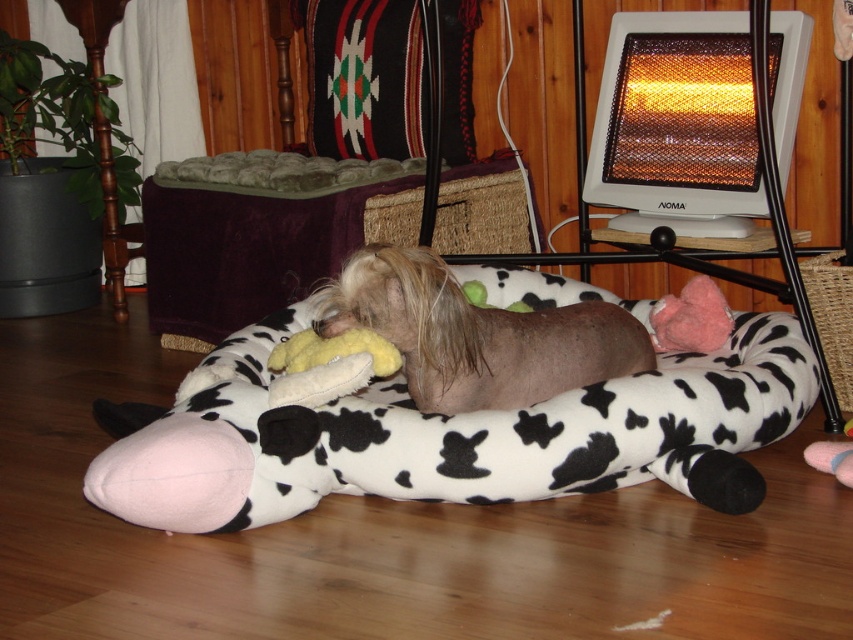
Is cow print plush bed at center taller than brown fuzzy dog at center?

Yes.

Can you confirm if cow print plush bed at center is bigger than brown fuzzy dog at center?

Correct, cow print plush bed at center is larger in size than brown fuzzy dog at center.

Is point (181, 257) less distant than point (474, 340)?

No, it is not.

You are a GUI agent. You are given a task and a screenshot of the screen. Output one action in this format:
    pyautogui.click(x=<x>, y=<y>)
    Task: Click on the cow print plush bed at center
    The height and width of the screenshot is (640, 853).
    Given the screenshot: What is the action you would take?
    pyautogui.click(x=258, y=240)

Is cow print plush bed at center below multicolored woven rug at upper center?

Correct, cow print plush bed at center is located below multicolored woven rug at upper center.

Between point (183, 298) and point (401, 124), which one is positioned behind?

The point (401, 124) is more distant.

I want to click on cow print plush bed at center, so click(x=258, y=240).

Is brown fuzzy dog at center further to the viewer compared to multicolored woven rug at upper center?

No.

Where is `brown fuzzy dog at center`? brown fuzzy dog at center is located at coordinates (476, 333).

Locate an element on the screen. The width and height of the screenshot is (853, 640). brown fuzzy dog at center is located at coordinates (476, 333).